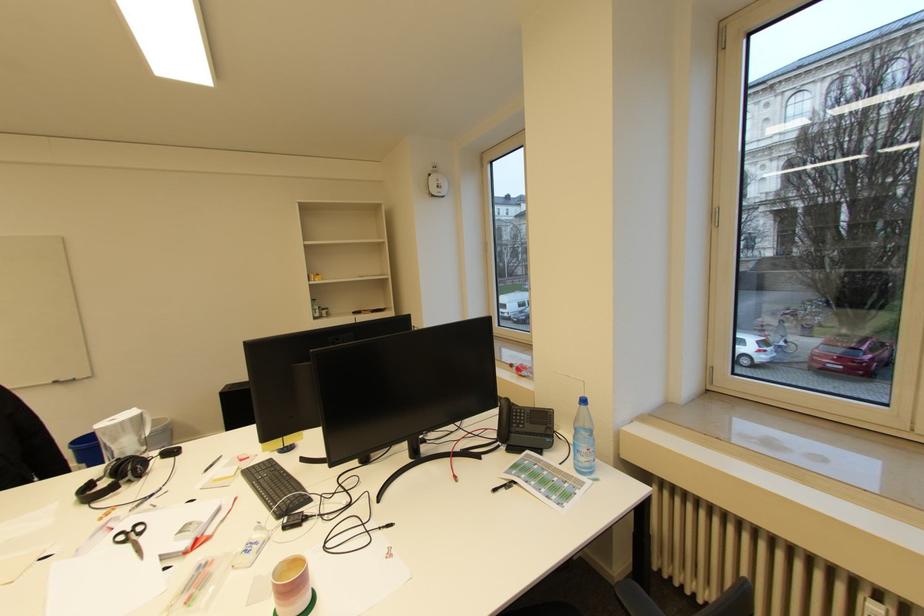
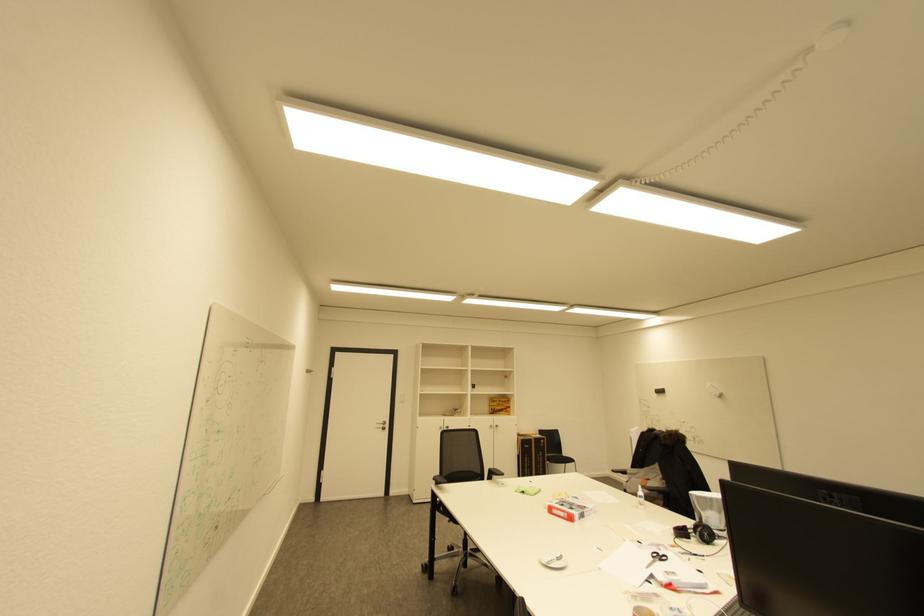
The point at (x=136, y=472) is marked in the first image. Where is the corresponding point in the second image?

(704, 533)